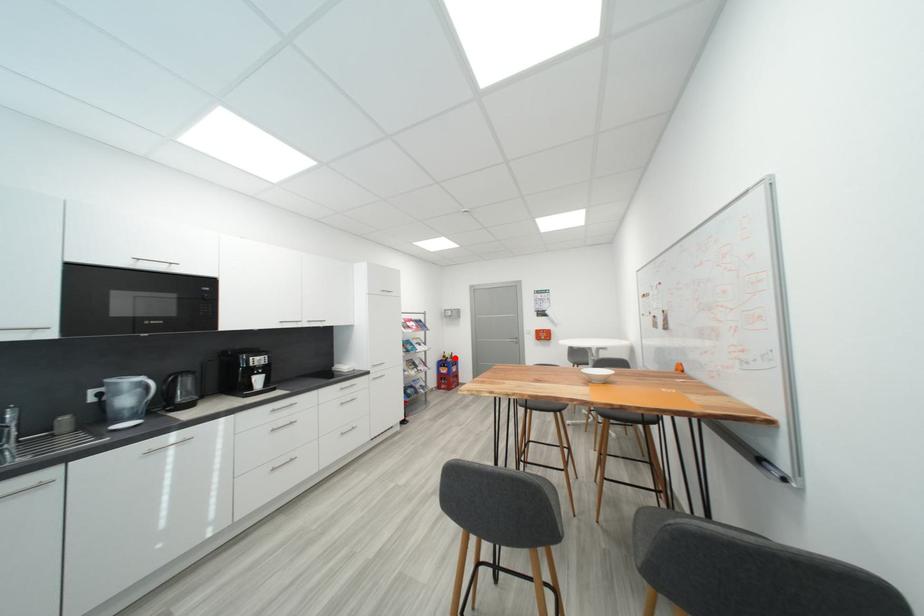
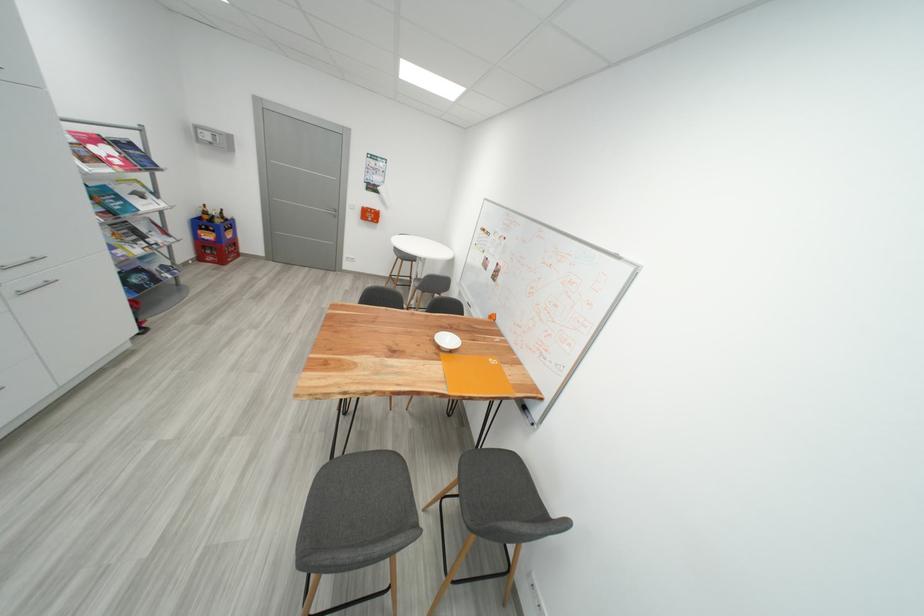
The point at the highlighted location is marked in the first image. Where is the corresponding point in the second image?

(220, 214)